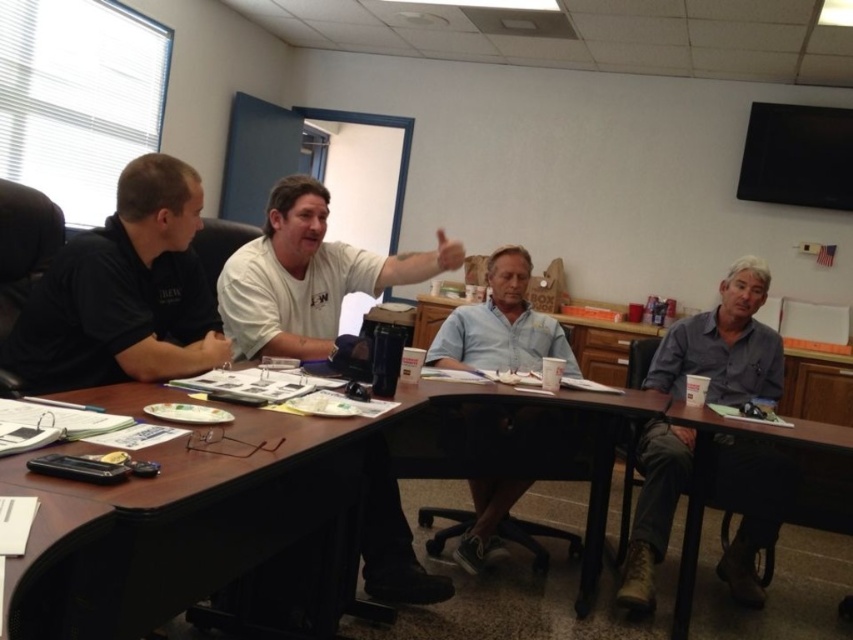
Question: Is black shirt at left smaller than gray fabric shirt at right?

Choices:
 (A) yes
 (B) no

Answer: (A)

Question: Considering the real-world distances, which object is farthest from the white cotton shirt at center?

Choices:
 (A) light blue shirt at center
 (B) brown wood table at center
 (C) black shirt at left

Answer: (B)

Question: Which object appears closest to the camera in this image?

Choices:
 (A) gray fabric shirt at right
 (B) white cotton shirt at center
 (C) brown wood table at center
 (D) black shirt at left

Answer: (C)

Question: Which object is the closest to the gray fabric shirt at right?

Choices:
 (A) black shirt at left
 (B) light blue shirt at center

Answer: (B)

Question: Does white cotton shirt at center have a lesser width compared to light blue shirt at center?

Choices:
 (A) no
 (B) yes

Answer: (A)

Question: Does black shirt at left have a greater width compared to white cotton shirt at center?

Choices:
 (A) no
 (B) yes

Answer: (A)